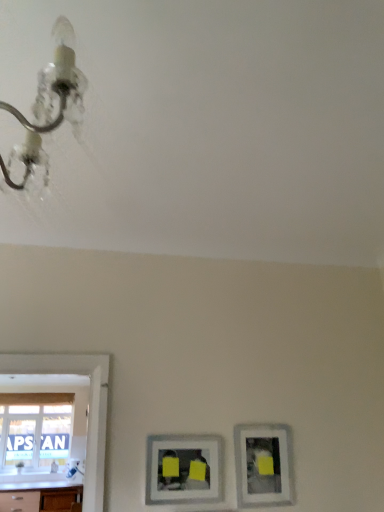
Question: From the image's perspective, is matte silver picture frame at lower center, marked as the first picture frame in a left-to-right arrangement, on white glossy countertop at lower left?

Choices:
 (A) no
 (B) yes

Answer: (B)

Question: Can you confirm if matte silver picture frame at lower center, the second picture frame positioned from the right, is smaller than white glossy countertop at lower left?

Choices:
 (A) yes
 (B) no

Answer: (A)

Question: Is matte silver picture frame at lower center, the second picture frame positioned from the right, completely or partially outside of white glossy countertop at lower left?

Choices:
 (A) no
 (B) yes

Answer: (B)

Question: Is matte silver picture frame at lower center, the second picture frame positioned from the right, positioned behind white glossy countertop at lower left?

Choices:
 (A) yes
 (B) no

Answer: (B)

Question: Can you confirm if matte silver picture frame at lower center, the second picture frame positioned from the right, is wider than white glossy countertop at lower left?

Choices:
 (A) yes
 (B) no

Answer: (B)

Question: Considering the relative sizes of matte silver picture frame at lower center, the second picture frame positioned from the right, and white glossy countertop at lower left in the image provided, is matte silver picture frame at lower center, the second picture frame positioned from the right, thinner than white glossy countertop at lower left?

Choices:
 (A) no
 (B) yes

Answer: (B)

Question: Can you confirm if matte silver picture frame at lower center, marked as the first picture frame in a left-to-right arrangement, is smaller than matte silver picture frame at lower right, which is counted as the 1th picture frame, starting from the right?

Choices:
 (A) yes
 (B) no

Answer: (A)

Question: Is matte silver picture frame at lower center, the second picture frame positioned from the right, bigger than matte silver picture frame at lower right, which is counted as the 1th picture frame, starting from the right?

Choices:
 (A) no
 (B) yes

Answer: (A)

Question: Could matte silver picture frame at lower right, the second picture frame positioned from the left, be considered to be inside matte silver picture frame at lower center, the second picture frame positioned from the right?

Choices:
 (A) yes
 (B) no

Answer: (B)

Question: Is matte silver picture frame at lower center, marked as the first picture frame in a left-to-right arrangement, positioned in front of matte silver picture frame at lower right, the second picture frame positioned from the left?

Choices:
 (A) no
 (B) yes

Answer: (B)

Question: Can you confirm if matte silver picture frame at lower center, the second picture frame positioned from the right, is positioned to the right of matte silver picture frame at lower right, which is counted as the 1th picture frame, starting from the right?

Choices:
 (A) yes
 (B) no

Answer: (B)

Question: Does matte silver picture frame at lower center, marked as the first picture frame in a left-to-right arrangement, have a greater height compared to matte silver picture frame at lower right, the second picture frame positioned from the left?

Choices:
 (A) no
 (B) yes

Answer: (A)

Question: Is matte silver picture frame at lower right, the second picture frame positioned from the left, outside white glossy countertop at lower left?

Choices:
 (A) no
 (B) yes

Answer: (B)